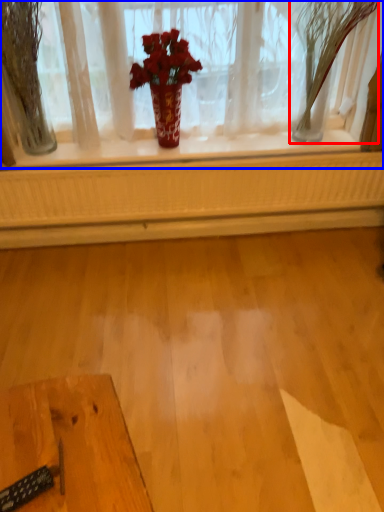
Question: Which object appears farthest to the camera in this image, tree (highlighted by a red box) or window (highlighted by a blue box)?

Choices:
 (A) tree
 (B) window

Answer: (B)